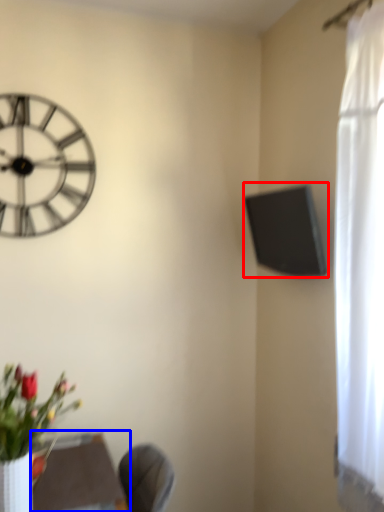
Question: Which point is closer to the camera, window screen (highlighted by a red box) or round table (highlighted by a blue box)?

Choices:
 (A) window screen
 (B) round table

Answer: (B)